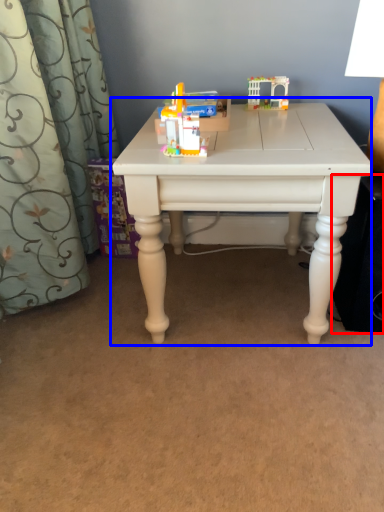
Question: Which point is further to the camera, speaker (highlighted by a red box) or table (highlighted by a blue box)?

Choices:
 (A) speaker
 (B) table

Answer: (A)